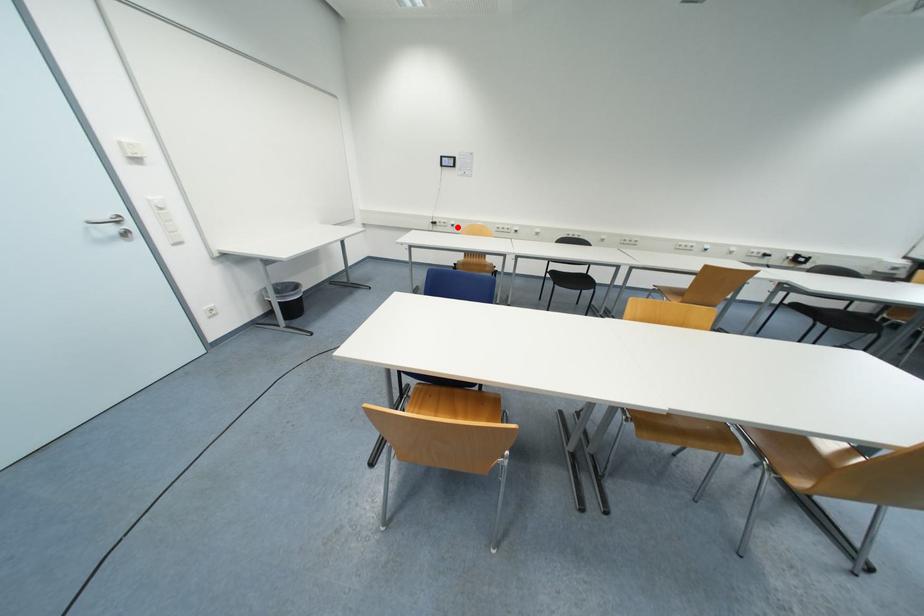
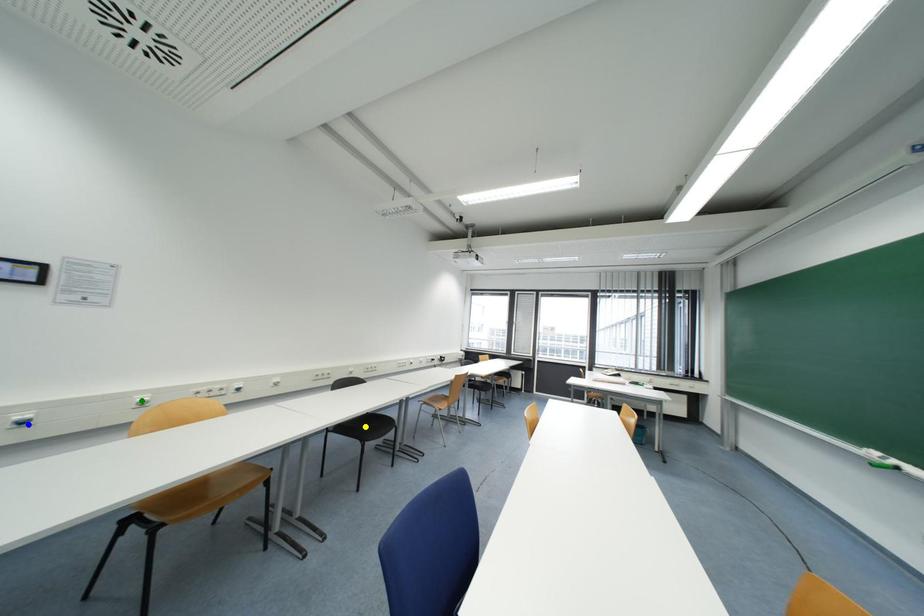
Question: I am providing you with two images of the same scene from different viewpoints. A red point is marked on the first image. You are given multiple points on the second image. Which point in image 2 is actually the same real-world point as the red point in image 1?

Choices:
 (A) green point
 (B) blue point
 (C) yellow point

Answer: (B)